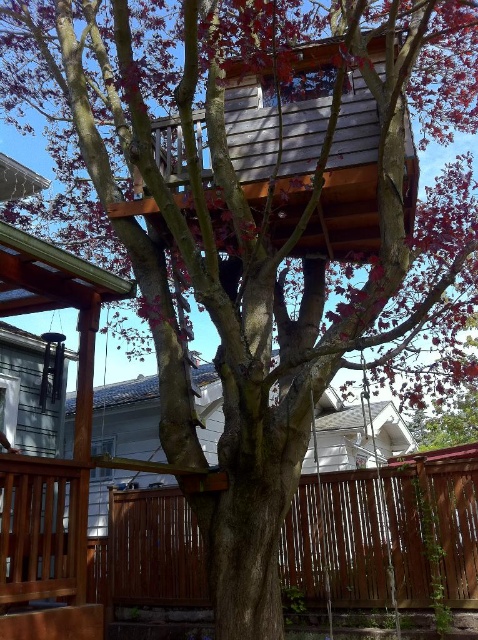
You are a delivery robot with a package that is 40 centimeters wide. You need to navigate from the brown wooden porch at lower left to the wooden swing at lower right. Is there enough space between them for you to pass through?

The brown wooden porch at lower left and wooden swing at lower right are 41.85 centimeters apart from each other. Since the robot is 40 centimeters wide, there is enough space for it to pass through the gap between them.

You are standing at the center of the image and want to walk to the brown wooden porch at lower left. In which direction should you move?

You should move to the lower left direction to reach the brown wooden porch at lower left.